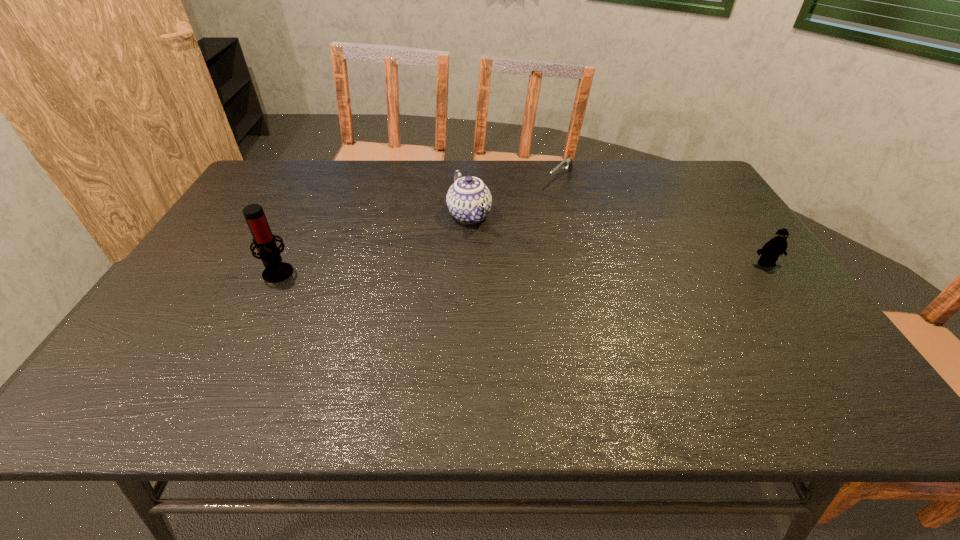
The width and height of the screenshot is (960, 540). I want to click on vacant space on the desktop that is between the leftmost object and the Lego and is positioned from the spout of the chinaware, so click(502, 268).

Find the location of `free spot on the desktop that is between the microphone and the Lego and is positioned on the front-facing side of the pistol`. free spot on the desktop that is between the microphone and the Lego and is positioned on the front-facing side of the pistol is located at coordinates (463, 269).